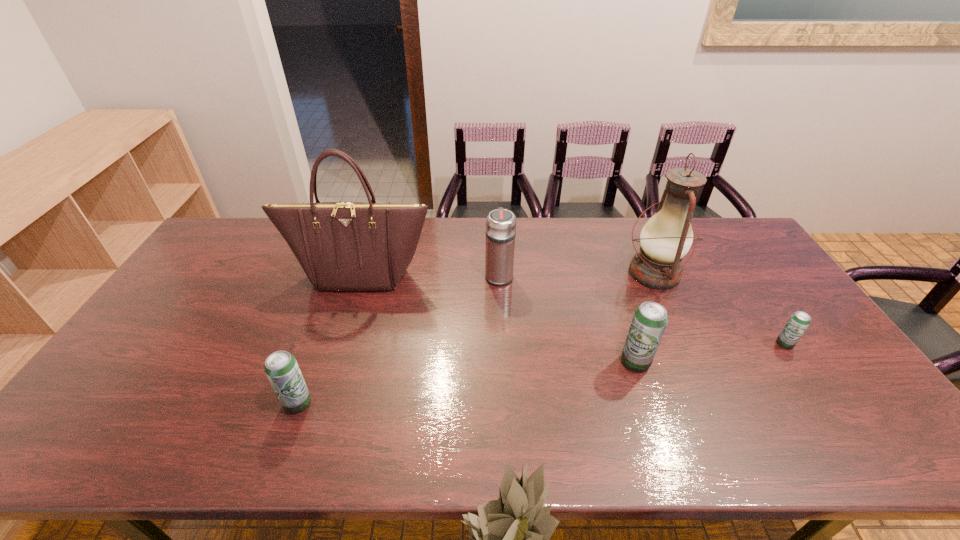
At what (x,y) coordinates should I click in order to perform the action: click on spot to insert another beer_can for uniform distribution. Please return your answer as a coordinate pair (x, y). This screenshot has height=540, width=960. Looking at the image, I should click on (473, 382).